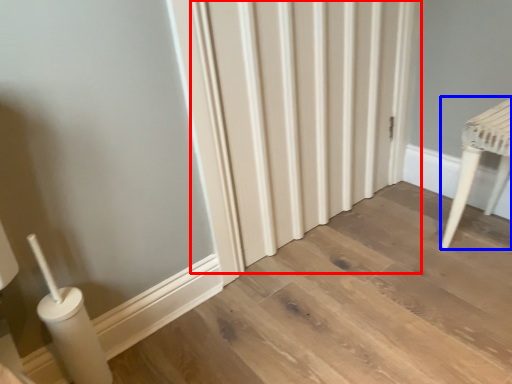
Question: Which of the following is the farthest to the observer, radiator (highlighted by a red box) or furniture (highlighted by a blue box)?

Choices:
 (A) radiator
 (B) furniture

Answer: (B)